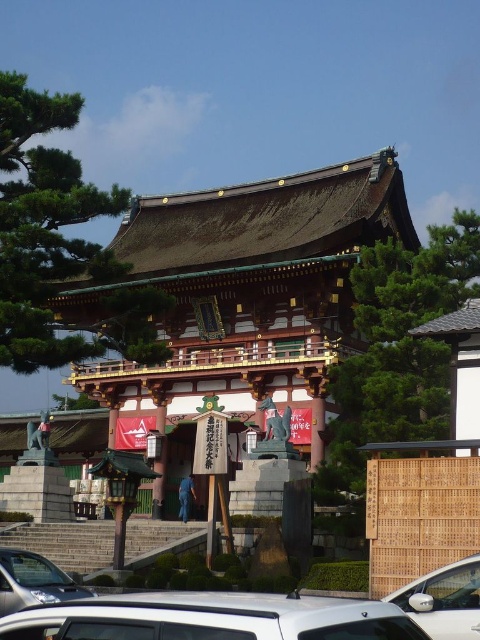
You are a photographer planning to capture a symmetrical shot of the shrine with both the white glossy car at lower right and the silver metallic car at lower left in the frame. Considering their heights, which car should be placed closer to the camera to maintain symmetry?

The white glossy car at lower right has a lesser height compared to the silver metallic car at lower left. To maintain symmetry, the shorter white glossy car at lower right should be placed closer to the camera so that its apparent size matches the taller silver metallic car at lower left.

Looking at this image, you are standing at the entrance of the shrine and notice a point marked at coordinates (244, 294). What object is located at that specific coordinate?

The shiny gold wooden temple is located at the coordinates (244, 294).